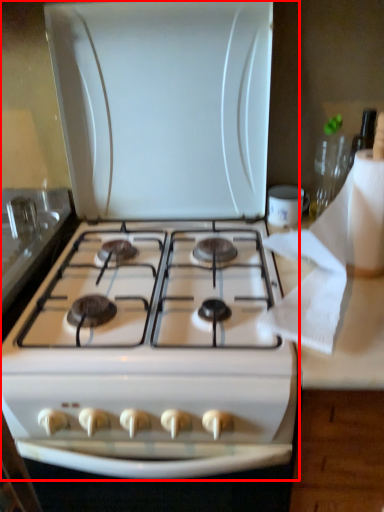
Question: In this image, where is gas stove (annotated by the red box) located relative to toilet paper?

Choices:
 (A) left
 (B) right

Answer: (A)